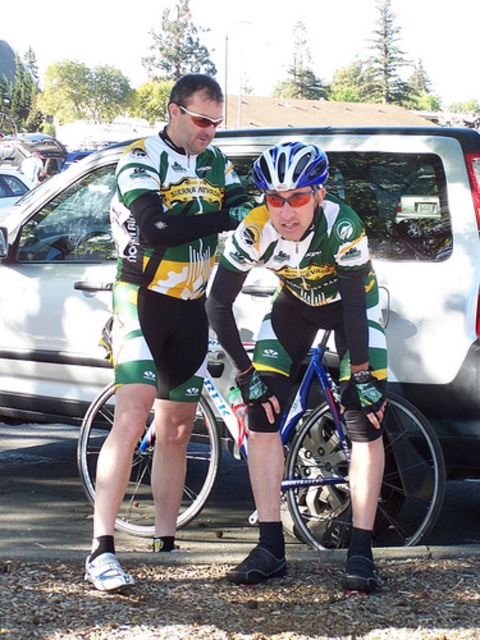
Question: Which point appears closest to the camera in this image?

Choices:
 (A) (418, 525)
 (B) (74, 364)
 (C) (274, 166)
 (D) (309, 192)

Answer: (D)

Question: Which object is closer to the camera taking this photo?

Choices:
 (A) blue glossy bicycle helmet at center
 (B) matte green jersey at center
 (C) white matte van at center
 (D) blue metallic bicycle at center

Answer: (A)

Question: Which point is farther to the camera?

Choices:
 (A) (253, 496)
 (B) (160, 380)

Answer: (B)

Question: Does matte green jersey at center appear under blue metallic bicycle at center?

Choices:
 (A) yes
 (B) no

Answer: (B)

Question: Does blue metallic bicycle at center have a larger size compared to blue reflective lens glasses at center?

Choices:
 (A) no
 (B) yes

Answer: (B)

Question: Considering the relative positions of blue metallic bicycle at center and blue reflective lens glasses at center in the image provided, where is blue metallic bicycle at center located with respect to blue reflective lens glasses at center?

Choices:
 (A) above
 (B) below

Answer: (B)